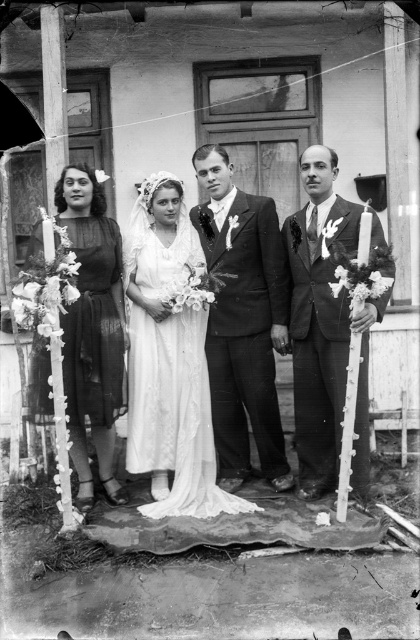
Question: Which point appears farthest from the camera in this image?

Choices:
 (A) (277, 284)
 (B) (86, 164)
 (C) (331, 317)
 (D) (173, 384)

Answer: (B)

Question: Can you confirm if white satin dress at center is bigger than smooth black suit at right?

Choices:
 (A) no
 (B) yes

Answer: (B)

Question: Is white satin dress at center positioned before smooth black suit at right?

Choices:
 (A) yes
 (B) no

Answer: (B)

Question: Which is farther from the smooth black suit at center?

Choices:
 (A) white satin dress at center
 (B) matte black dress at left

Answer: (B)

Question: Which is nearer to the matte black dress at left?

Choices:
 (A) smooth black suit at center
 (B) white satin dress at center

Answer: (B)

Question: Can you confirm if smooth black suit at center is positioned to the left of smooth black suit at right?

Choices:
 (A) yes
 (B) no

Answer: (A)